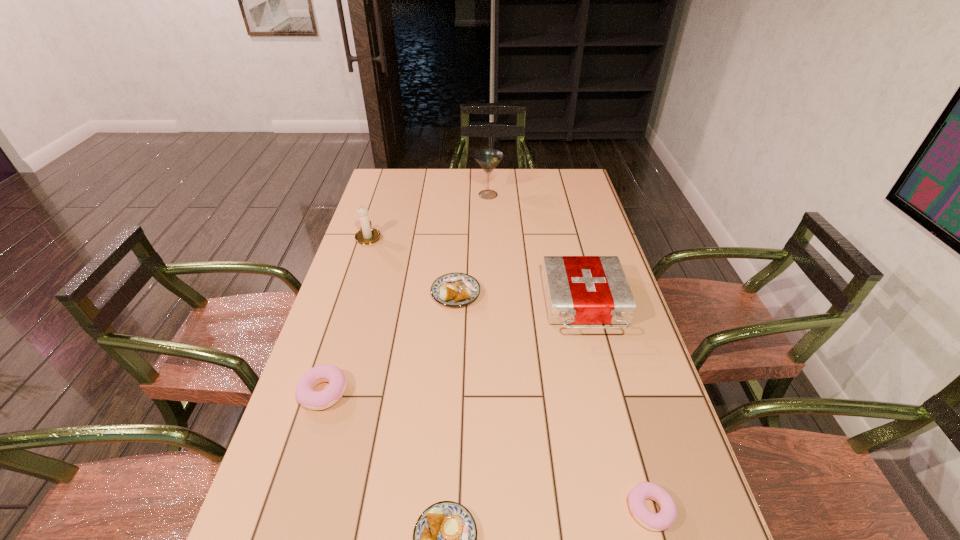
Identify the location of object that is at the far edge. (488, 159).

The image size is (960, 540). I want to click on candle holder that is at the left edge, so point(368,235).

I want to click on pastry that is at the left edge, so click(306, 396).

Where is `the first-aid kit that is at the right edge`? This screenshot has width=960, height=540. the first-aid kit that is at the right edge is located at coordinates (578, 289).

Identify the location of pastry positioned at the right edge. coord(666,517).

I want to click on blank space at the far edge of the desktop, so click(456, 193).

At what (x,y) coordinates should I click in order to perform the action: click on vacant space at the left edge of the desktop. Please return your answer as a coordinate pair (x, y). Looking at the image, I should click on (336, 346).

Image resolution: width=960 pixels, height=540 pixels. What are the coordinates of `free space at the right edge of the desktop` in the screenshot? It's located at (643, 362).

Find the location of a particular element. vacant space at the far left corner of the desktop is located at coordinates (411, 185).

Where is `free space between the sixth shortest object and the bigger pink pastry`? This screenshot has width=960, height=540. free space between the sixth shortest object and the bigger pink pastry is located at coordinates (347, 314).